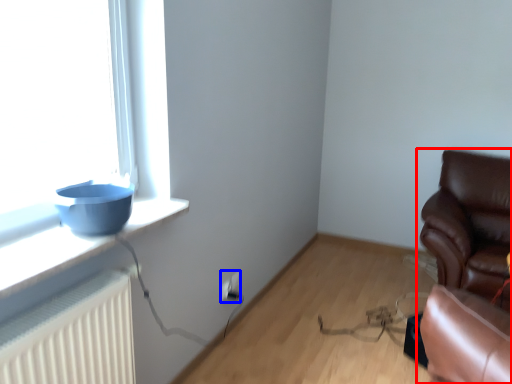
Question: Among these objects, which one is nearest to the camera, chair (highlighted by a red box) or electric outlet (highlighted by a blue box)?

Choices:
 (A) chair
 (B) electric outlet

Answer: (A)